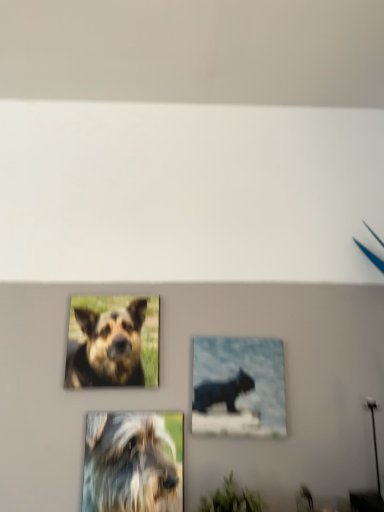
This screenshot has height=512, width=384. What do you see at coordinates (238, 387) in the screenshot?
I see `matte black cat at center` at bounding box center [238, 387].

Find the location of `green matte plant at lower center`. green matte plant at lower center is located at coordinates (232, 499).

What do you see at coordinates (133, 462) in the screenshot?
I see `fuzzy fur dog at center, which is the second dog from top to bottom` at bounding box center [133, 462].

Identify the location of matte black cat at center. (238, 387).

Is green matte plant at lower center outside of fuzzy fur dog at center, the first dog ordered from the bottom?

Absolutely, green matte plant at lower center is external to fuzzy fur dog at center, the first dog ordered from the bottom.

Between green matte plant at lower center and fuzzy fur dog at center, which is the second dog from top to bottom, which one has more height?

With more height is fuzzy fur dog at center, which is the second dog from top to bottom.

Based on the photo, can you confirm if green matte plant at lower center is positioned to the right of fuzzy fur dog at center, which is the second dog from top to bottom?

Correct, you'll find green matte plant at lower center to the right of fuzzy fur dog at center, which is the second dog from top to bottom.

Which is farther from the camera, [207,509] or [146,468]?

Point [146,468]

Does brown fur dog at upper left, which ranks as the 1th dog in back-to-front order, have a smaller size compared to fuzzy fur dog at center, the first dog positioned from the front?

No.

Does brown fur dog at upper left, which ranks as the 1th dog in back-to-front order, come behind fuzzy fur dog at center, which is the second dog from top to bottom?

Yes, it is behind fuzzy fur dog at center, which is the second dog from top to bottom.

Which is more to the right, brown fur dog at upper left, placed as the second dog when sorted from front to back, or fuzzy fur dog at center, which is the second dog from top to bottom?

Positioned to the right is fuzzy fur dog at center, which is the second dog from top to bottom.

Does matte black cat at center come in front of brown fur dog at upper left, which is the second dog in bottom-to-top order?

That is True.

I want to click on dog above the matte black cat at center (from a real-world perspective), so click(107, 347).

How many degrees apart are the facing directions of matte black cat at center and brown fur dog at upper left, which ranks as the 1th dog in back-to-front order?

0.00221 degrees separate the facing orientations of matte black cat at center and brown fur dog at upper left, which ranks as the 1th dog in back-to-front order.

Is matte black cat at center at the left side of brown fur dog at upper left, the first dog in the top-to-bottom sequence?

No.

Considering the positions of points (120, 417) and (256, 510), is point (120, 417) closer to camera compared to point (256, 510)?

No, it is behind (256, 510).

From the image's perspective, is fuzzy fur dog at center, which is the second dog from top to bottom, below green matte plant at lower center?

Incorrect, from the image's perspective, fuzzy fur dog at center, which is the second dog from top to bottom, is higher than green matte plant at lower center.

Is fuzzy fur dog at center, the 2th dog viewed from the back, facing towards green matte plant at lower center?

No, fuzzy fur dog at center, the 2th dog viewed from the back, is not facing towards green matte plant at lower center.

Where is `plant located in front of the fuzzy fur dog at center, the 2th dog viewed from the back`? Image resolution: width=384 pixels, height=512 pixels. plant located in front of the fuzzy fur dog at center, the 2th dog viewed from the back is located at coordinates (232, 499).

Is matte black cat at center inside fuzzy fur dog at center, the 2th dog viewed from the back?

No, matte black cat at center is not surrounded by fuzzy fur dog at center, the 2th dog viewed from the back.

From the image's perspective, is fuzzy fur dog at center, the first dog ordered from the bottom, located beneath matte black cat at center?

Yes, from the image's perspective, fuzzy fur dog at center, the first dog ordered from the bottom, is below matte black cat at center.

Is fuzzy fur dog at center, the 2th dog viewed from the back, to the left or to the right of matte black cat at center in the image?

Based on their positions, fuzzy fur dog at center, the 2th dog viewed from the back, is located to the left of matte black cat at center.

Who is more distant, fuzzy fur dog at center, the first dog positioned from the front, or matte black cat at center?

matte black cat at center is further away from the camera.

From the image's perspective, is brown fur dog at upper left, placed as the second dog when sorted from front to back, above or below matte black cat at center?

Based on their image positions, brown fur dog at upper left, placed as the second dog when sorted from front to back, is located above matte black cat at center.

Is point (132, 312) positioned before point (197, 372)?

No, (132, 312) is behind (197, 372).

Could you tell me if brown fur dog at upper left, placed as the second dog when sorted from front to back, is facing matte black cat at center?

No, brown fur dog at upper left, placed as the second dog when sorted from front to back, does not turn towards matte black cat at center.

Considering the relative positions of brown fur dog at upper left, which ranks as the 1th dog in back-to-front order, and green matte plant at lower center in the image provided, is brown fur dog at upper left, which ranks as the 1th dog in back-to-front order, to the right of green matte plant at lower center from the viewer's perspective?

No.

Is brown fur dog at upper left, the first dog in the top-to-bottom sequence, thinner than green matte plant at lower center?

Correct, the width of brown fur dog at upper left, the first dog in the top-to-bottom sequence, is less than that of green matte plant at lower center.

Can you confirm if brown fur dog at upper left, which ranks as the 1th dog in back-to-front order, is bigger than green matte plant at lower center?

Incorrect, brown fur dog at upper left, which ranks as the 1th dog in back-to-front order, is not larger than green matte plant at lower center.

Between point (86, 362) and point (248, 498), which one is positioned behind?

Point (86, 362)

Find the location of a particular element. the 1st dog counting from the left of the green matte plant at lower center is located at coordinates (133, 462).

The height and width of the screenshot is (512, 384). What are the coordinates of `dog behind the fuzzy fur dog at center, the first dog ordered from the bottom` in the screenshot? It's located at (107, 347).

Based on their spatial positions, is brown fur dog at upper left, the first dog in the top-to-bottom sequence, or matte black cat at center closer to green matte plant at lower center?

The object closer to green matte plant at lower center is matte black cat at center.

Estimate the real-world distances between objects in this image. Which object is further from matte black cat at center, green matte plant at lower center or brown fur dog at upper left, the first dog in the top-to-bottom sequence?

brown fur dog at upper left, the first dog in the top-to-bottom sequence.

Based on their spatial positions, is matte black cat at center or fuzzy fur dog at center, which is the second dog from top to bottom, further from green matte plant at lower center?

matte black cat at center is further to green matte plant at lower center.

From the image, which object appears to be nearer to matte black cat at center, fuzzy fur dog at center, the 2th dog viewed from the back, or brown fur dog at upper left, which ranks as the 1th dog in back-to-front order?

fuzzy fur dog at center, the 2th dog viewed from the back, is closer to matte black cat at center.

Estimate the real-world distances between objects in this image. Which object is closer to matte black cat at center, green matte plant at lower center or fuzzy fur dog at center, the first dog ordered from the bottom?

fuzzy fur dog at center, the first dog ordered from the bottom.

Based on their spatial positions, is green matte plant at lower center or brown fur dog at upper left, which ranks as the 1th dog in back-to-front order, closer to fuzzy fur dog at center, the first dog positioned from the front?

brown fur dog at upper left, which ranks as the 1th dog in back-to-front order, lies closer to fuzzy fur dog at center, the first dog positioned from the front, than the other object.

From the image, which object appears to be farther from fuzzy fur dog at center, the first dog ordered from the bottom, matte black cat at center or green matte plant at lower center?

green matte plant at lower center is positioned further to the anchor fuzzy fur dog at center, the first dog ordered from the bottom.

Based on their spatial positions, is matte black cat at center or brown fur dog at upper left, placed as the second dog when sorted from front to back, further from green matte plant at lower center?

brown fur dog at upper left, placed as the second dog when sorted from front to back, is positioned further to the anchor green matte plant at lower center.

You are a GUI agent. You are given a task and a screenshot of the screen. Output one action in this format:
    pyautogui.click(x=<x>, y=<y>)
    Task: Click on the dog situated between brown fur dog at upper left, which is the second dog in bottom-to-top order, and matte black cat at center from left to right
    Image resolution: width=384 pixels, height=512 pixels.
    Given the screenshot: What is the action you would take?
    pyautogui.click(x=133, y=462)

The width and height of the screenshot is (384, 512). I want to click on plant located between fuzzy fur dog at center, the first dog ordered from the bottom, and matte black cat at center in the left-right direction, so click(x=232, y=499).

Image resolution: width=384 pixels, height=512 pixels. What are the coordinates of `plant between brown fur dog at upper left, the first dog in the top-to-bottom sequence, and matte black cat at center from left to right` in the screenshot? It's located at (232, 499).

This screenshot has height=512, width=384. I want to click on dog between brown fur dog at upper left, which ranks as the 1th dog in back-to-front order, and green matte plant at lower center, in the vertical direction, so click(x=133, y=462).